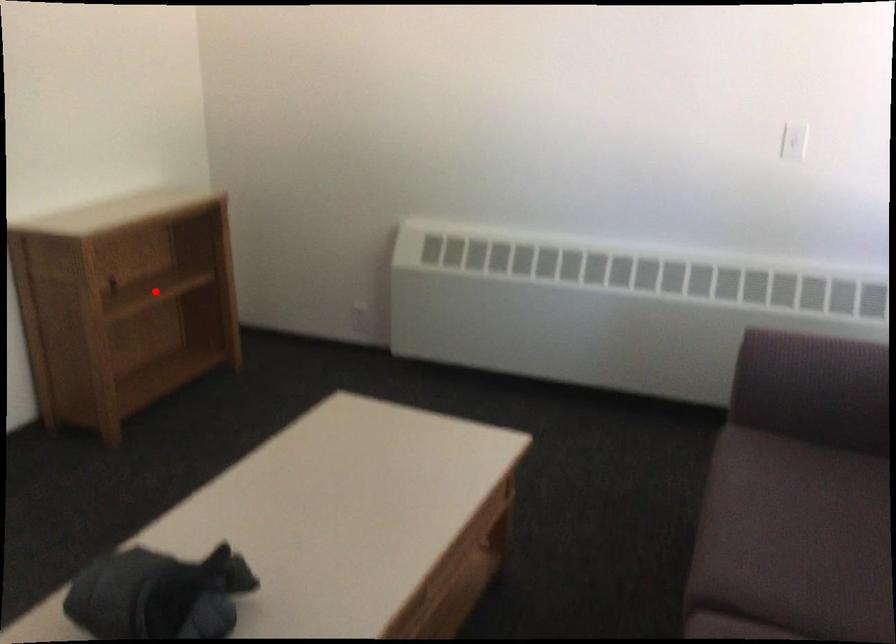
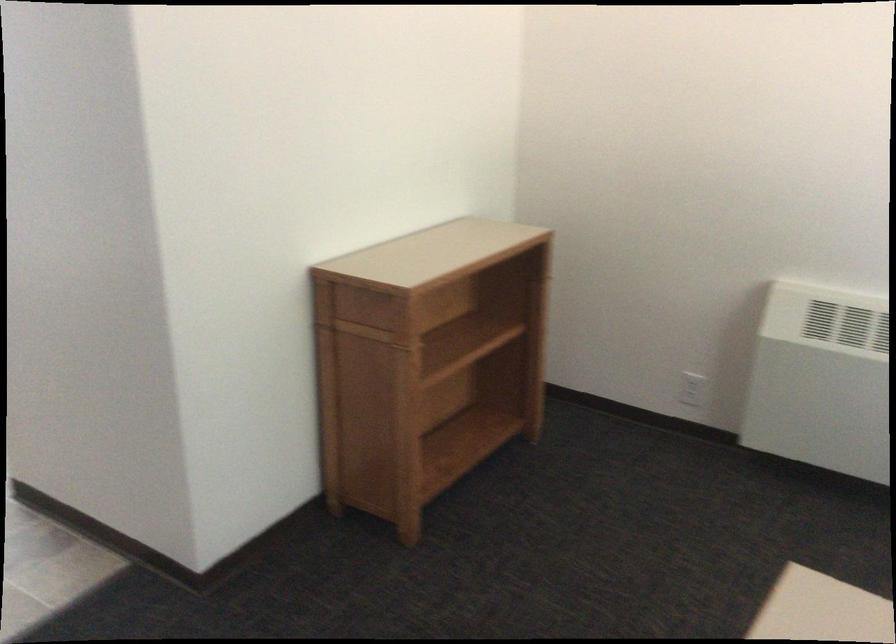
Where in the second image is the point corresponding to the highlighted location from the first image?

(462, 345)